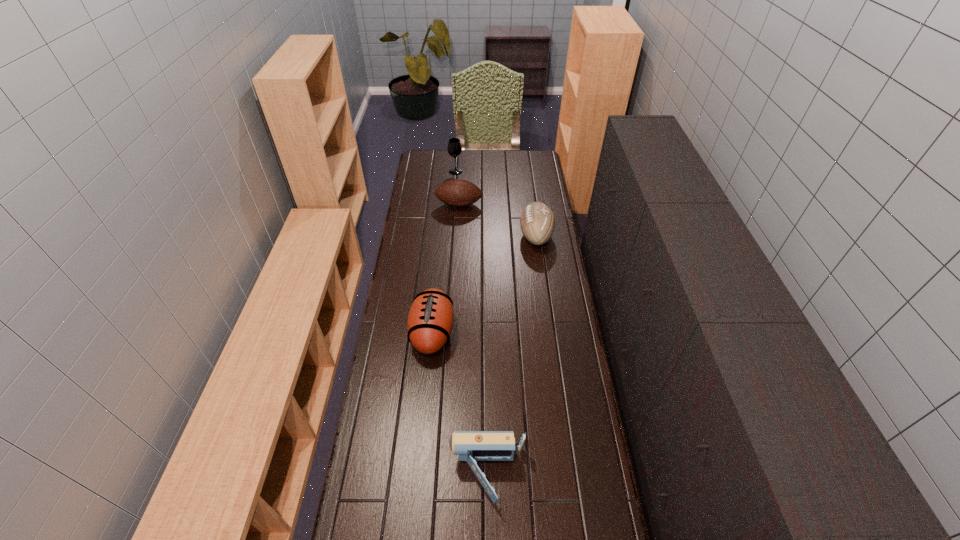
Where is `the farthest object`? the farthest object is located at coordinates (454, 148).

The image size is (960, 540). Find the location of `wineglass`. wineglass is located at coordinates (454, 148).

This screenshot has height=540, width=960. Identify the location of the nearest football. (430, 321).

The image size is (960, 540). Find the location of `the third nearest object`. the third nearest object is located at coordinates (537, 222).

The image size is (960, 540). Find the location of `the rightmost football`. the rightmost football is located at coordinates (537, 222).

Locate an element on the screen. The width and height of the screenshot is (960, 540). the farthest football is located at coordinates (458, 193).

Where is `the nearest object`? the nearest object is located at coordinates (471, 446).

Image resolution: width=960 pixels, height=540 pixels. In order to click on vacant area situated on the left of the wineglass in this screenshot , I will do `click(438, 172)`.

Locate an element on the screen. This screenshot has height=540, width=960. blank space located on the right of the fourth farthest object is located at coordinates (557, 333).

Find the location of `free space located 0.140m on the laces of the rightmost object`. free space located 0.140m on the laces of the rightmost object is located at coordinates (490, 236).